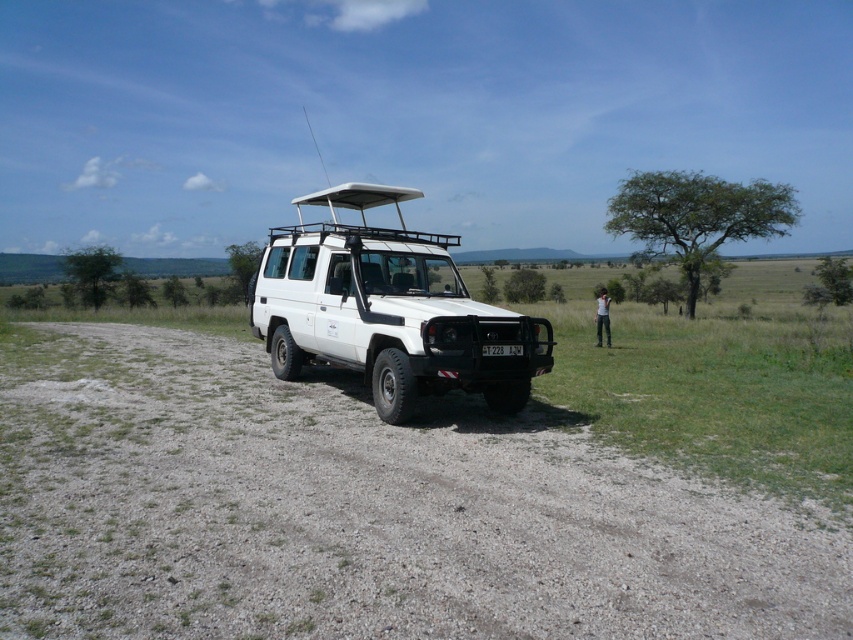
Question: Is white matte jeep at center bigger than black plastic license plate at center?

Choices:
 (A) no
 (B) yes

Answer: (B)

Question: Can you confirm if dirt/gravel road at lower left is positioned to the left of black plastic license plate at center?

Choices:
 (A) no
 (B) yes

Answer: (B)

Question: Observing the image, what is the correct spatial positioning of white matte jeep at center in reference to black plastic license plate at center?

Choices:
 (A) left
 (B) right

Answer: (A)

Question: Which object appears closest to the camera in this image?

Choices:
 (A) dirt/gravel road at lower left
 (B) black plastic license plate at center
 (C) white matte jeep at center

Answer: (A)

Question: Which point is closer to the camera taking this photo?

Choices:
 (A) (442, 534)
 (B) (485, 353)

Answer: (A)

Question: Which object is the farthest from the white matte jeep at center?

Choices:
 (A) dirt/gravel road at lower left
 (B) black plastic license plate at center

Answer: (A)